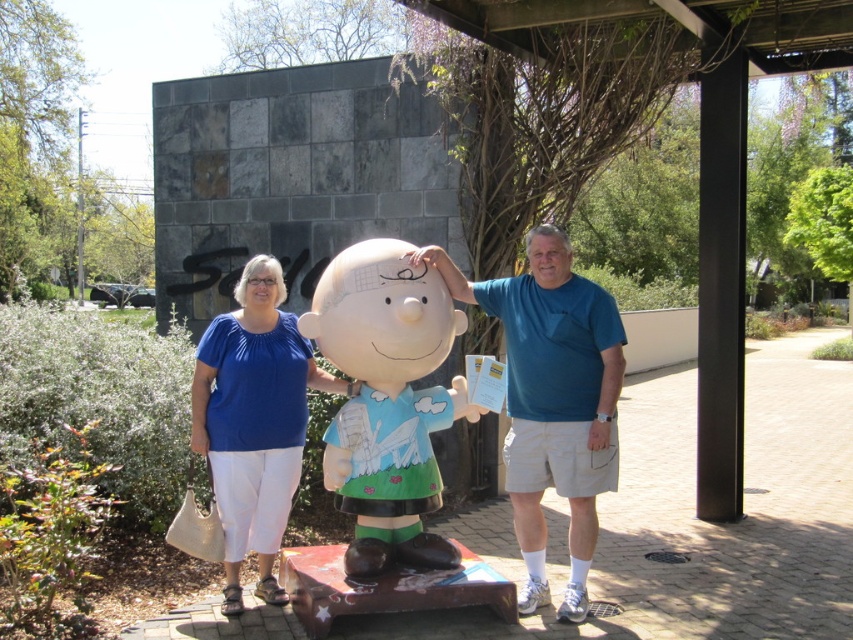
Based on the photo, is smooth plastic statue at center below matte blue blouse at center?

No.

Is point (451, 308) positioned after point (253, 330)?

Yes, point (451, 308) is behind point (253, 330).

Who is more distant from viewer, (x=389, y=404) or (x=259, y=403)?

Positioned behind is point (x=389, y=404).

This screenshot has height=640, width=853. I want to click on smooth plastic statue at center, so click(x=387, y=400).

Can you confirm if blue cotton shirt at center is bigger than matte blue blouse at center?

Indeed, blue cotton shirt at center has a larger size compared to matte blue blouse at center.

You are a GUI agent. You are given a task and a screenshot of the screen. Output one action in this format:
    pyautogui.click(x=<x>, y=<y>)
    Task: Click on the blue cotton shirt at center
    
    Given the screenshot: What is the action you would take?
    pyautogui.click(x=552, y=401)

Is the position of matte blue shirt at center less distant than that of blue cotton shirt at center?

That is True.

In the scene shown: Is matte blue shirt at center to the left of blue cotton shirt at center from the viewer's perspective?

Yes, matte blue shirt at center is to the left of blue cotton shirt at center.

Who is more distant from viewer, (x=360, y=497) or (x=578, y=456)?

The point (x=578, y=456) is behind.

The image size is (853, 640). Find the location of `matte blue shirt at center`. matte blue shirt at center is located at coordinates coord(389,374).